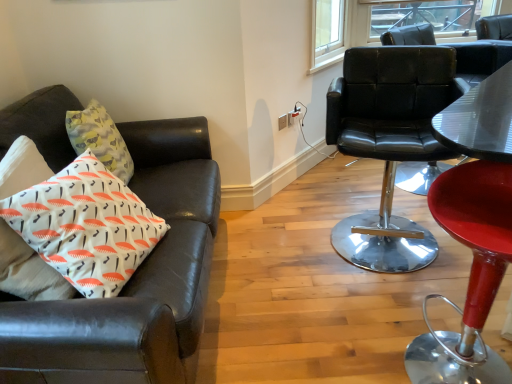
Locate an element on the screen. The height and width of the screenshot is (384, 512). vacant space that is to the left of red leather bar stool at right, the first chair in the right-to-left sequence is located at coordinates (345, 350).